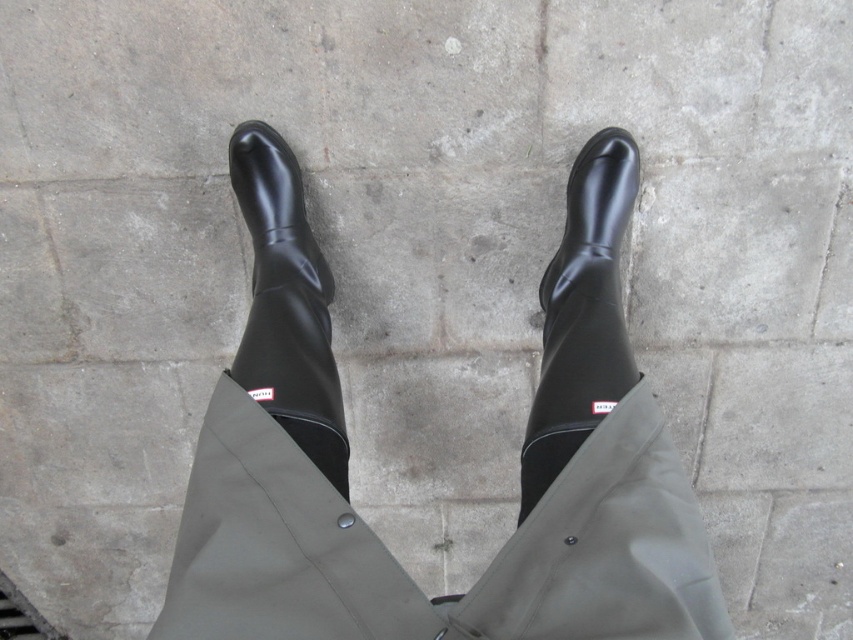
You are trying to decide which boot to wear for a rainy day. You have two options in front of you, the black rubber boot at center and the shiny black boot at center. Based on their thickness, which one might provide better protection against water seeping in through the sides?

The shiny black boot at center is thicker than the black rubber boot at center, so it might provide better protection against water seeping in through the sides.

You are a photographer adjusting your camera settings. You notice two points in the image at coordinates point [556,381] and point [285,280]. Which point should you focus on to ensure it appears sharp in the final photo if you want the closest object to the camera to be in focus?

You should focus on point [556,381] because it is closer to the camera than point [285,280], ensuring it will be sharp in the photo.